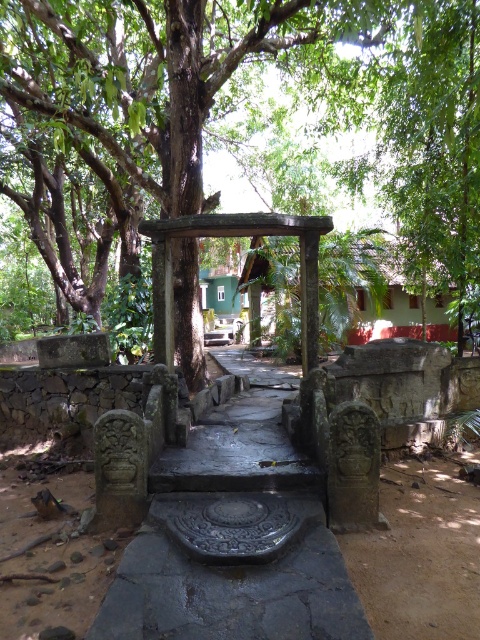
You are standing at the entrance of the temple grounds and notice a green leafy tree at center and a carved stone gazebo at center. Which object has a narrower width?

The green leafy tree at center is thinner than the carved stone gazebo at center, so the green leafy tree at center has a narrower width.

You are a visitor standing at the entrance of the temple grounds. You see a green leafy tree at center and a carved stone gazebo at center. Which one is taller?

The carved stone gazebo at center is taller than the green leafy tree at center.

You are standing at the entrance of the temple grounds and see the green leafy tree at center and the carved stone gazebo at center. Which object is positioned to the left of the other?

The green leafy tree at center is positioned to the left of the carved stone gazebo at center.